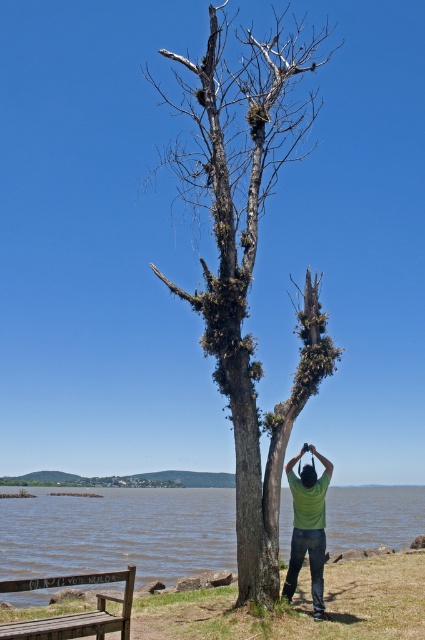
How much distance is there between dead wood tree at center and brown water at lower center?

dead wood tree at center is 13.75 meters away from brown water at lower center.

Is dead wood tree at center to the right of brown water at lower center from the viewer's perspective?

Yes, dead wood tree at center is to the right of brown water at lower center.

Who is more forward, (263, 113) or (232, 497)?

Positioned in front is point (263, 113).

Locate an element on the screen. This screenshot has width=425, height=640. dead wood tree at center is located at coordinates (249, 256).

From the picture: Between dead wood tree at center and green matte shirt at center, which one has less height?

With less height is green matte shirt at center.

Who is lower down, dead wood tree at center or green matte shirt at center?

green matte shirt at center is lower down.

This screenshot has height=640, width=425. What are the coordinates of `dead wood tree at center` in the screenshot? It's located at (249, 256).

Locate an element on the screen. dead wood tree at center is located at coordinates (249, 256).

Which of these two, dead wood tree at center or wooden bench at lower left, stands taller?

dead wood tree at center is taller.

Is point (203, 188) positioned in front of point (124, 605)?

No.

Between point (206, 70) and point (50, 577), which one is positioned in front?

Point (206, 70)

You are a GUI agent. You are given a task and a screenshot of the screen. Output one action in this format:
    pyautogui.click(x=<x>, y=<y>)
    Task: Click on the dead wood tree at center
    Image resolution: width=425 pixels, height=640 pixels.
    Given the screenshot: What is the action you would take?
    pyautogui.click(x=249, y=256)